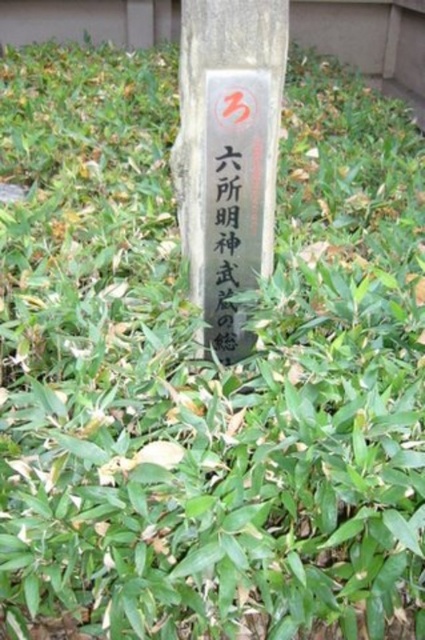
You are designing a garden layout and need to place a 4.5 inch wide decorative item between the black stone sign at center and the green paper at center. Is there enough space for it?

The distance between the black stone sign at center and the green paper at center is 3.48 inches, which is less than the 4.5 inch width of the decorative item. Therefore, there is not enough space to place it between them.

You are a hiker who found a black stone sign at center and a green paper at center in a forest. Which object should you pay attention to for important information?

The black stone sign at center is larger in size than the green paper at center, so you should pay attention to the black stone sign at center for important information.

You are a hiker who has come across a black stone sign at center and a green paper at center in a forest. According to the scene description, which object is positioned higher up?

The black stone sign at center is located above the green paper at center, so it is positioned higher up.